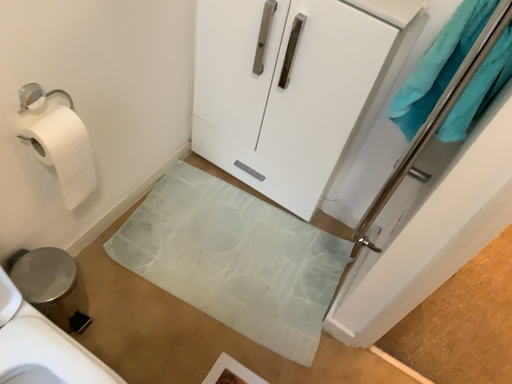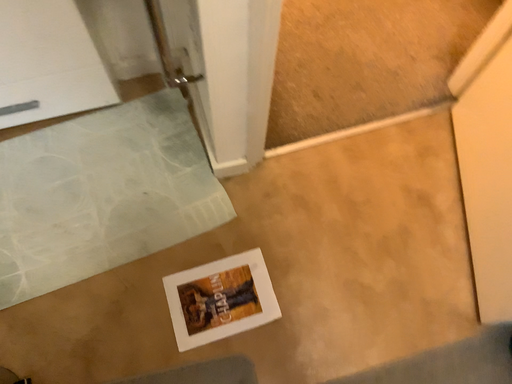
Question: How did the camera likely rotate when shooting the video?

Choices:
 (A) rotated left
 (B) rotated right

Answer: (B)